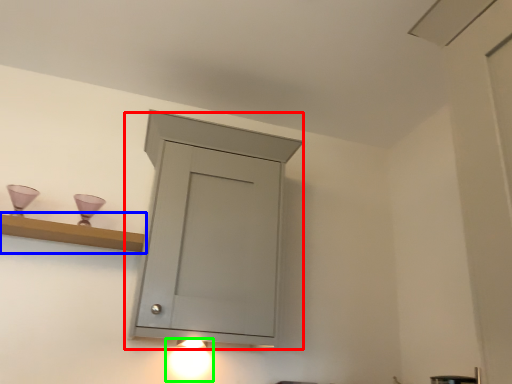
Question: Which object is positioned closest to cupboard (highlighted by a red box)? Select from shelf (highlighted by a blue box) and light fixture (highlighted by a green box).

Choices:
 (A) shelf
 (B) light fixture

Answer: (A)